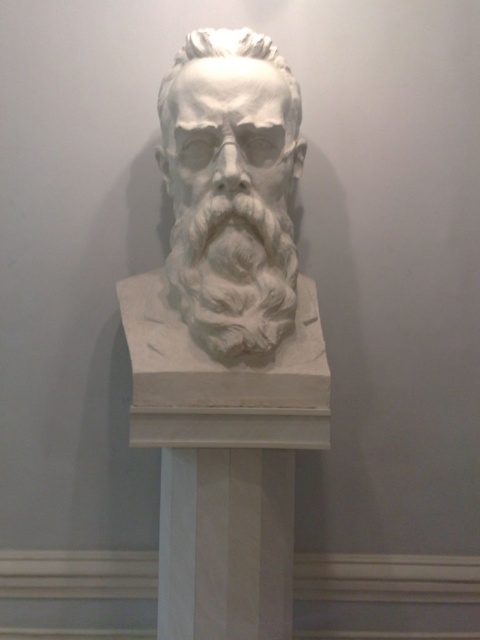
You are an art conservator standing at the entrance of the gallery. You need to place a protective barrier around the white marble pedestal at center. Where exactly should you position the barrier to ensure it surrounds the pedestal?

The white marble pedestal at center is located at point (x=226, y=544), so you should position the barrier around those coordinates to surround it.